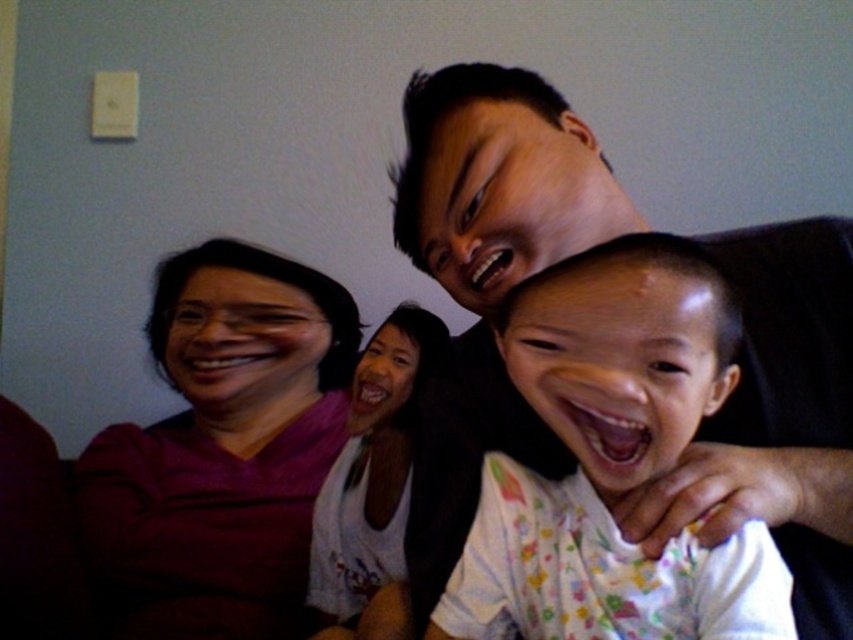
Between purple matte shirt at left and white cotton shirt at center, which one is positioned lower?

Positioned lower is purple matte shirt at left.

Between purple matte shirt at left and white cotton shirt at center, which one is positioned higher?

Positioned higher is white cotton shirt at center.

You are a GUI agent. You are given a task and a screenshot of the screen. Output one action in this format:
    pyautogui.click(x=<x>, y=<y>)
    Task: Click on the purple matte shirt at left
    
    Given the screenshot: What is the action you would take?
    pyautogui.click(x=222, y=449)

Locate an element on the screen. This screenshot has width=853, height=640. black matte shirt at upper right is located at coordinates (776, 420).

Between point (486, 390) and point (257, 266), which one is positioned behind?

Point (257, 266)

This screenshot has height=640, width=853. Identify the location of black matte shirt at upper right. (776, 420).

Is black matte shirt at upper right to the right of white cotton shirt at center from the viewer's perspective?

Correct, you'll find black matte shirt at upper right to the right of white cotton shirt at center.

Is black matte shirt at upper right to the left of white cotton shirt at center from the viewer's perspective?

Incorrect, black matte shirt at upper right is not on the left side of white cotton shirt at center.

Is point (434, 522) positioned after point (412, 348)?

No, (434, 522) is closer to viewer.

Where is `black matte shirt at upper right`? black matte shirt at upper right is located at coordinates (776, 420).